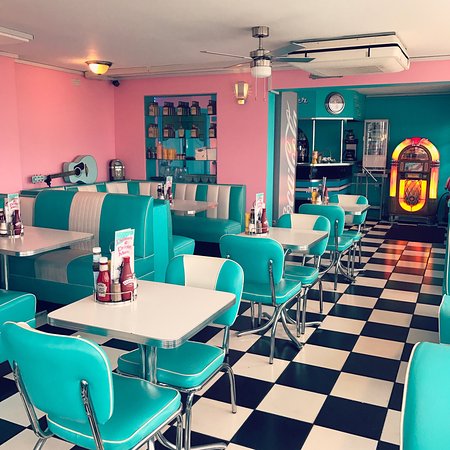
The image size is (450, 450). I want to click on pink wall, so click(x=65, y=114).